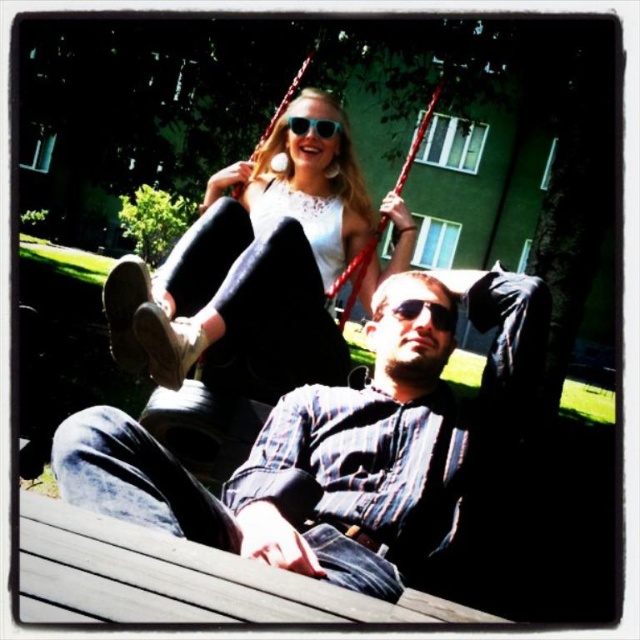
Looking at this image, between denim jeans at center and matte white blouse at upper center, which one has less height?

Standing shorter between the two is denim jeans at center.

Can you confirm if denim jeans at center is shorter than matte white blouse at upper center?

Correct, denim jeans at center is not as tall as matte white blouse at upper center.

Locate an element on the screen. The image size is (640, 640). denim jeans at center is located at coordinates (349, 449).

At what (x,y) coordinates should I click in order to perform the action: click on denim jeans at center. Please return your answer as a coordinate pair (x, y). Image resolution: width=640 pixels, height=640 pixels. Looking at the image, I should click on (349, 449).

Who is lower down, matte white blouse at upper center or sunglasses at upper center?

matte white blouse at upper center is below.

From the picture: Can you confirm if matte white blouse at upper center is positioned below sunglasses at upper center?

Indeed, matte white blouse at upper center is positioned under sunglasses at upper center.

Who is more distant from viewer, (136, 323) or (316, 122)?

The point (316, 122) is more distant.

Image resolution: width=640 pixels, height=640 pixels. Identify the location of matte white blouse at upper center. (250, 256).

Can you confirm if denim jeans at center is positioned below sunglasses at upper center?

Indeed, denim jeans at center is positioned under sunglasses at upper center.

Based on the photo, who is positioned more to the right, denim jeans at center or sunglasses at upper center?

From the viewer's perspective, denim jeans at center appears more on the right side.

The height and width of the screenshot is (640, 640). What are the coordinates of `denim jeans at center` in the screenshot? It's located at (349, 449).

Find the location of a particular element. denim jeans at center is located at coordinates tap(349, 449).